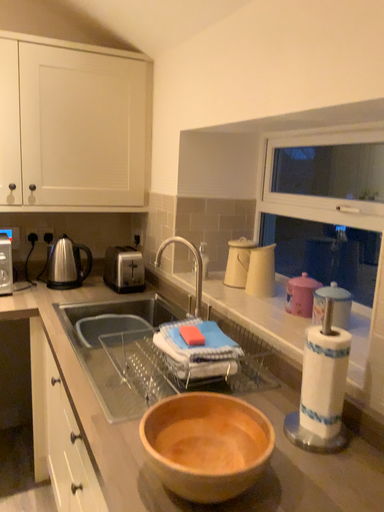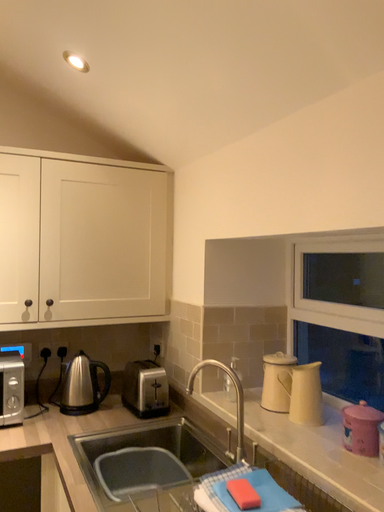
Question: Which way did the camera rotate in the video?

Choices:
 (A) rotated downward
 (B) rotated upward

Answer: (B)